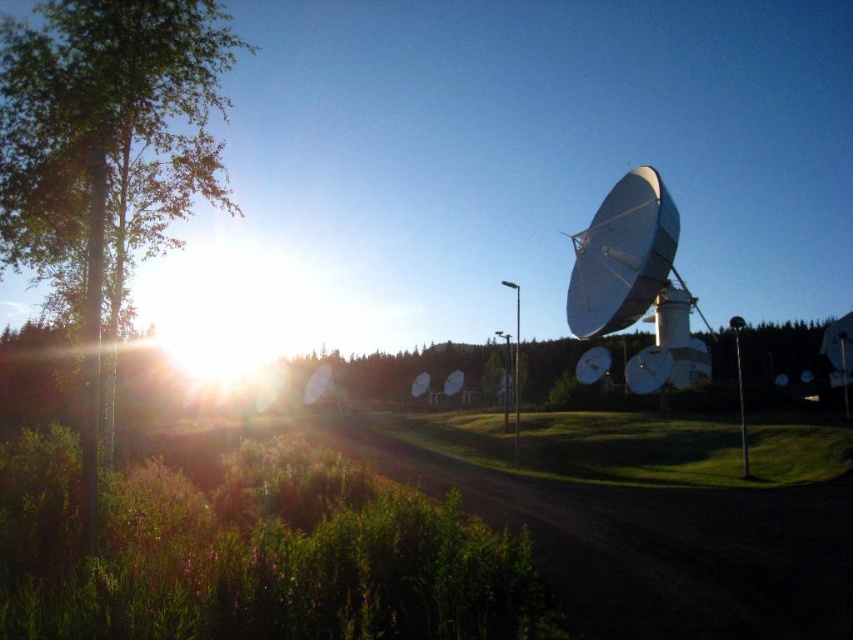
You are standing in the middle of the scene and want to take a photo of both the green leafy tree at left and the white glossy satellite dish at right. Which object will appear taller in your photo?

The green leafy tree at left will appear taller in the photo because it has a greater height compared to the white glossy satellite dish at right.

You are standing in the middle of the scene and want to take a photo of the green leafy tree at left and the green grass at center. Which object will appear larger in the photo?

The green leafy tree at left will appear larger in the photo because it is much taller than the green grass at center.